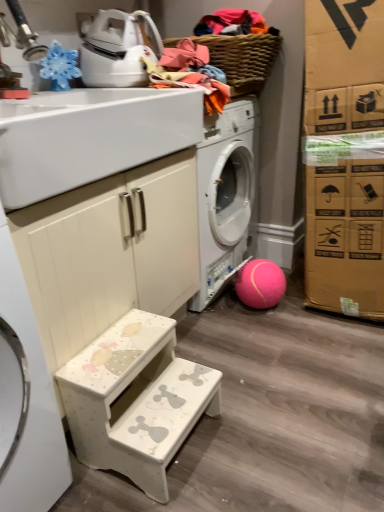
Where is `free spot above white painted wood step stool at lower left (from a real-world perspective)`? free spot above white painted wood step stool at lower left (from a real-world perspective) is located at coordinates (123, 351).